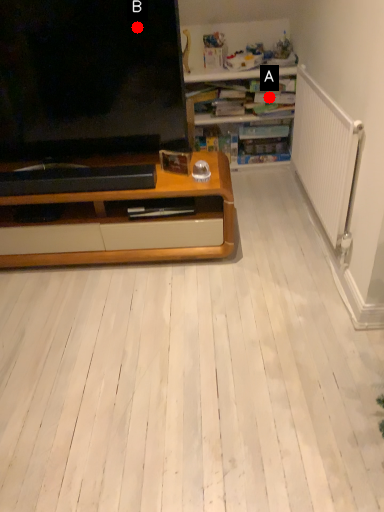
Question: Two points are circled on the image, labeled by A and B beside each circle. Which point is closer to the camera?

Choices:
 (A) A is closer
 (B) B is closer

Answer: (B)